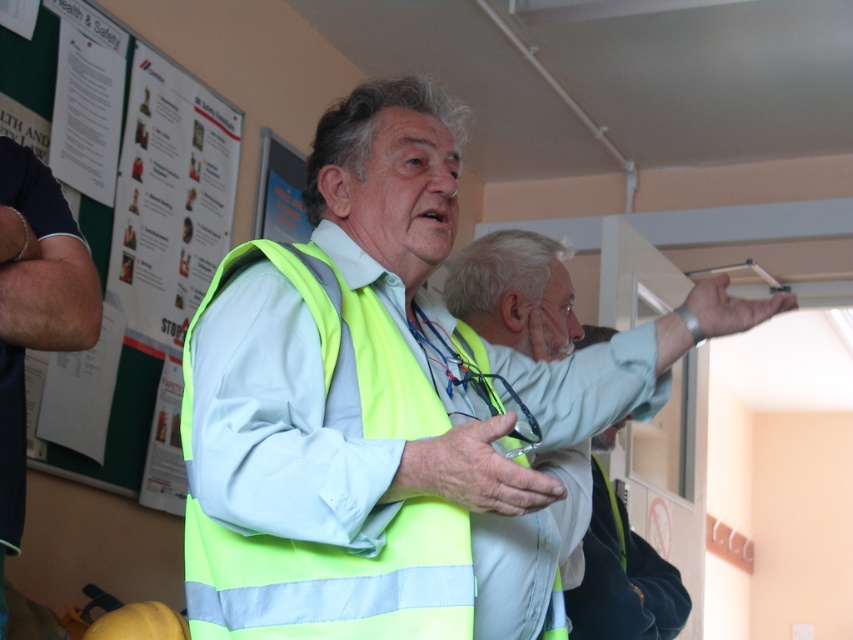
Question: Which point is farther to the camera?

Choices:
 (A) (126, 284)
 (B) (480, 276)

Answer: (A)

Question: Is green reflective vest at left smaller than yellow reflective vest at center?

Choices:
 (A) no
 (B) yes

Answer: (A)

Question: Which object is the farthest from the green reflective vest at left?

Choices:
 (A) yellow reflective vest at center
 (B) neon yellow reflective vest at center

Answer: (B)

Question: Does green reflective vest at left have a smaller size compared to yellow reflective vest at center?

Choices:
 (A) yes
 (B) no

Answer: (B)

Question: Which point is closer to the camera?

Choices:
 (A) (132, 168)
 (B) (366, 588)
 (C) (544, 321)

Answer: (B)

Question: In this image, where is neon yellow reflective vest at center located relative to yellow reflective vest at center?

Choices:
 (A) left
 (B) right

Answer: (A)